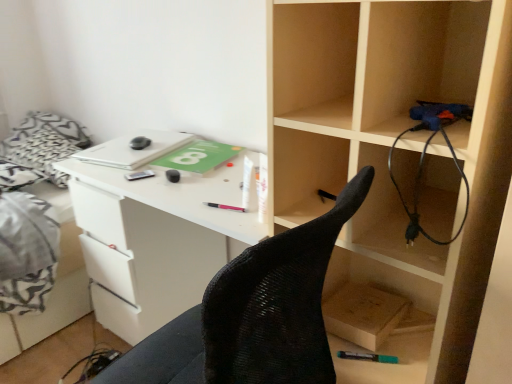
Locate an element on the screen. free space above black mesh chair at center (from a real-world perspective) is located at coordinates (174, 159).